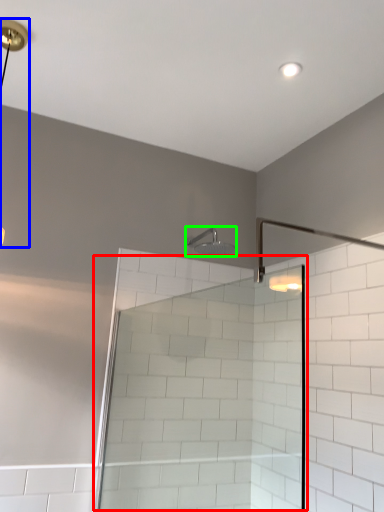
Question: Which is nearer to the screen door (highlighted by a red box)? lamp (highlighted by a blue box) or shower (highlighted by a green box).

Choices:
 (A) lamp
 (B) shower

Answer: (B)